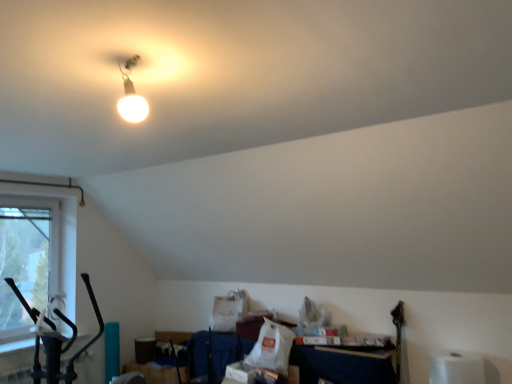
Question: Considering the relative sizes of white matte toilet paper at lower right and clear glass window at left in the image provided, is white matte toilet paper at lower right thinner than clear glass window at left?

Choices:
 (A) yes
 (B) no

Answer: (B)

Question: From the image's perspective, is white matte toilet paper at lower right located beneath clear glass window at left?

Choices:
 (A) yes
 (B) no

Answer: (A)

Question: From a real-world perspective, is white matte toilet paper at lower right physically above clear glass window at left?

Choices:
 (A) yes
 (B) no

Answer: (B)

Question: Is white matte toilet paper at lower right further to the viewer compared to clear glass window at left?

Choices:
 (A) yes
 (B) no

Answer: (B)

Question: Does white matte toilet paper at lower right have a smaller size compared to clear glass window at left?

Choices:
 (A) no
 (B) yes

Answer: (B)

Question: In the image, is white matte toilet paper at lower right positioned in front of or behind clear glass window at left?

Choices:
 (A) behind
 (B) front

Answer: (B)

Question: In terms of size, does white matte toilet paper at lower right appear bigger or smaller than clear glass window at left?

Choices:
 (A) big
 (B) small

Answer: (B)

Question: Is point (456, 372) closer or farther from the camera than point (61, 243)?

Choices:
 (A) closer
 (B) farther

Answer: (A)

Question: Is white matte toilet paper at lower right wider or thinner than clear glass window at left?

Choices:
 (A) wide
 (B) thin

Answer: (A)

Question: Looking at the image, does matte white bulb at upper center seem bigger or smaller compared to white matte toilet paper at lower right?

Choices:
 (A) big
 (B) small

Answer: (B)

Question: Would you say matte white bulb at upper center is to the left or to the right of white matte toilet paper at lower right in the picture?

Choices:
 (A) right
 (B) left

Answer: (B)

Question: From a real-world perspective, is matte white bulb at upper center above or below white matte toilet paper at lower right?

Choices:
 (A) above
 (B) below

Answer: (A)

Question: Which is correct: matte white bulb at upper center is inside white matte toilet paper at lower right, or outside of it?

Choices:
 (A) outside
 (B) inside

Answer: (A)

Question: From the image's perspective, relative to clear glass window at left, is matte white bulb at upper center above or below?

Choices:
 (A) below
 (B) above

Answer: (B)

Question: From their relative heights in the image, would you say matte white bulb at upper center is taller or shorter than clear glass window at left?

Choices:
 (A) tall
 (B) short

Answer: (B)